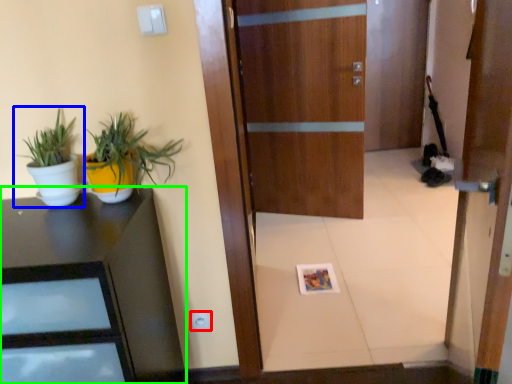
Question: Based on their relative distances, which object is farther from electric outlet (highlighted by a red box)? Choose from houseplant (highlighted by a blue box) and desk (highlighted by a green box).

Choices:
 (A) houseplant
 (B) desk

Answer: (A)